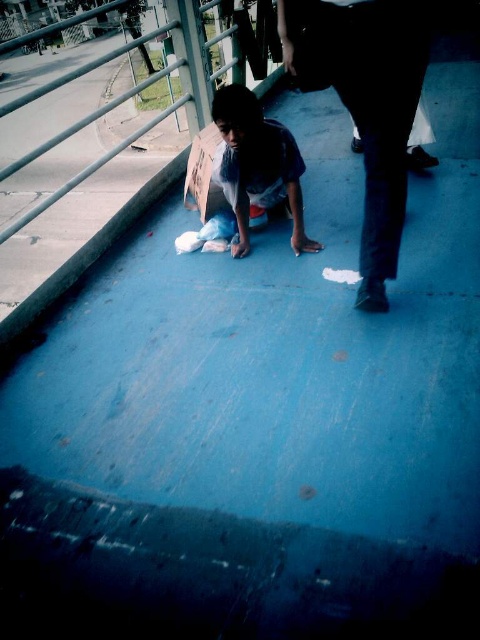
Is dark fabric pants at center below blue denim jeans at center?

Indeed, dark fabric pants at center is positioned under blue denim jeans at center.

Between dark fabric pants at center and blue denim jeans at center, which one has less height?

With less height is blue denim jeans at center.

The height and width of the screenshot is (640, 480). I want to click on dark fabric pants at center, so click(x=368, y=106).